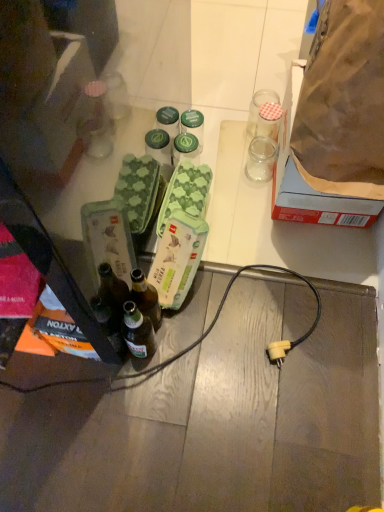
Question: Based on their sizes in the image, would you say green matte jar at center is bigger or smaller than brown paper bag at upper right?

Choices:
 (A) big
 (B) small

Answer: (B)

Question: Is green matte jar at center situated inside brown paper bag at upper right or outside?

Choices:
 (A) outside
 (B) inside

Answer: (A)

Question: Which of these objects is positioned closest to the clear glass jar at upper right, which is the 2th coffee cup in bottom-to-top order?

Choices:
 (A) transparent glass jar at upper right, which ranks as the first coffee cup in bottom-to-top order
 (B) green cardboard egg carton at center
 (C) green matte jar at center
 (D) brown paper bag at upper right

Answer: (A)

Question: Based on their relative distances, which object is nearer to the clear glass jar at upper right, which is counted as the first coffee cup, starting from the top?

Choices:
 (A) green matte jar at center
 (B) transparent glass jar at upper right, which ranks as the first coffee cup in bottom-to-top order
 (C) green cardboard egg carton at center
 (D) brown paper bag at upper right

Answer: (B)